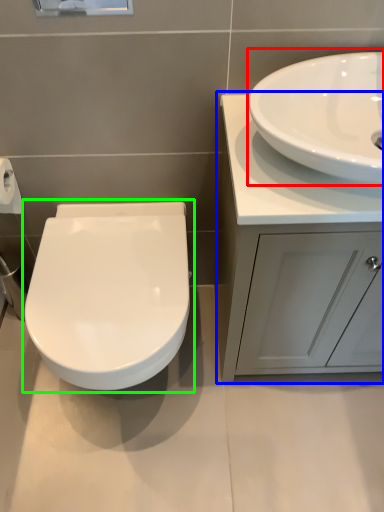
Question: Which is farther away from sink (highlighted by a red box)? bathroom cabinet (highlighted by a blue box) or toilet (highlighted by a green box)?

Choices:
 (A) bathroom cabinet
 (B) toilet

Answer: (B)